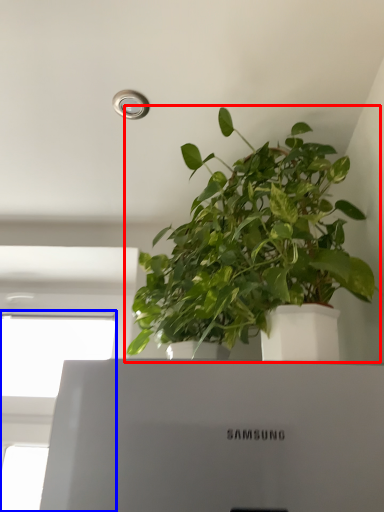
Question: Which of the following is the farthest to the observer, houseplant (highlighted by a red box) or window (highlighted by a blue box)?

Choices:
 (A) houseplant
 (B) window

Answer: (A)